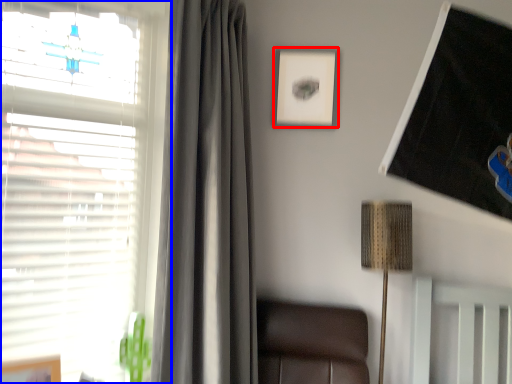
Question: Which of the following is the farthest to the observer, picture frame (highlighted by a red box) or window (highlighted by a blue box)?

Choices:
 (A) picture frame
 (B) window

Answer: (A)